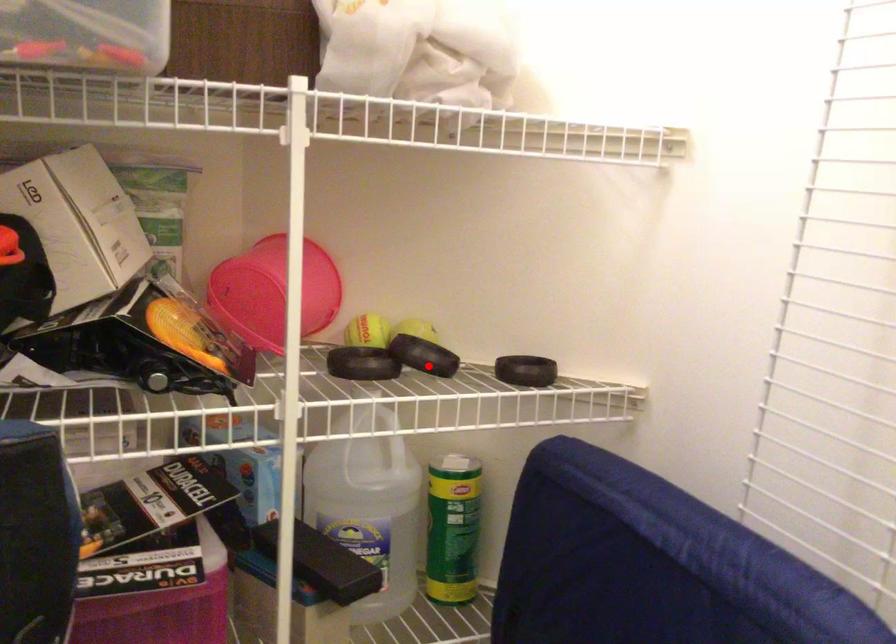
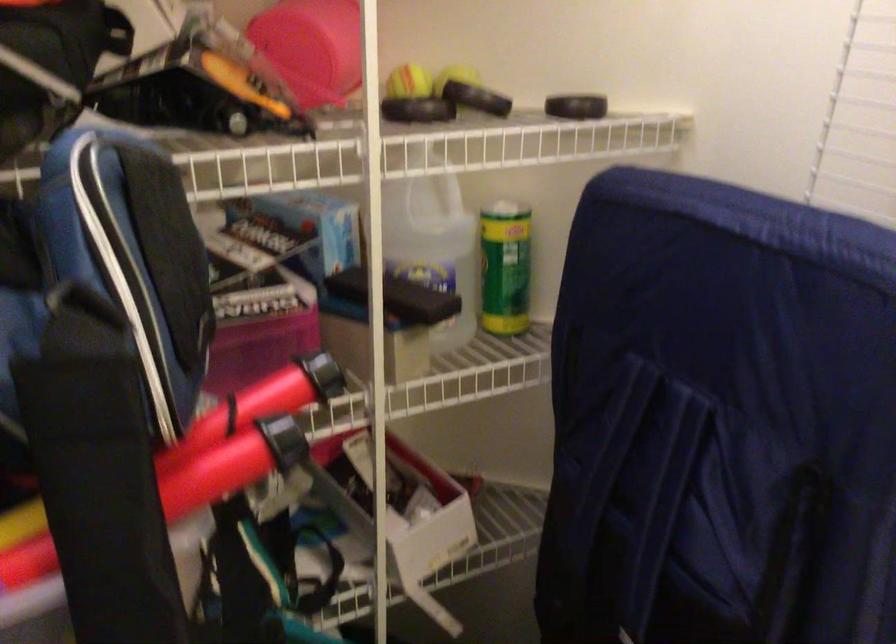
Find the pixel in the second image that matches the highlighted location in the first image.

(487, 100)